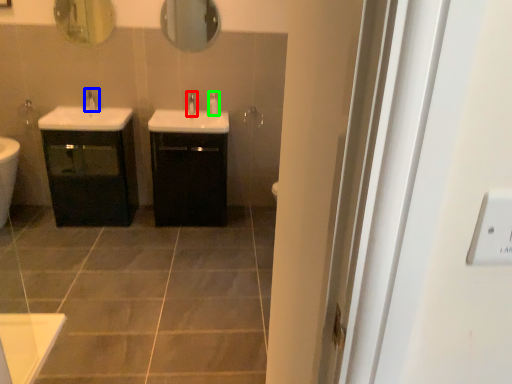
Question: Based on their relative distances, which object is nearer to tap (highlighted by a red box)? Choose from tap (highlighted by a blue box) and soap dispenser (highlighted by a green box).

Choices:
 (A) tap
 (B) soap dispenser

Answer: (B)